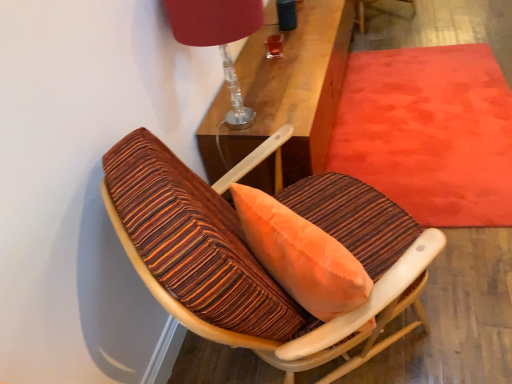
Where is `wooden textured chair at center`? Image resolution: width=512 pixels, height=384 pixels. wooden textured chair at center is located at coordinates (220, 262).

Image resolution: width=512 pixels, height=384 pixels. Identify the location of velvet red mat at upper right. (429, 132).

This screenshot has height=384, width=512. Find the location of `wooden textured chair at center`. wooden textured chair at center is located at coordinates (220, 262).

Is wooden textured chair at center facing towards velvet red mat at upper right?

Yes, wooden textured chair at center is oriented towards velvet red mat at upper right.

Which of these two, wooden textured chair at center or velvet red mat at upper right, is bigger?

wooden textured chair at center.

Who is more distant, wooden textured chair at center or velvet red mat at upper right?

velvet red mat at upper right is further away from the camera.

From the picture: From a real-world perspective, is wooden textured chair at center located higher than velvet red mat at upper right?

Yes.

From a real-world perspective, is matte red lampshade at upper center positioned above or below velvet red mat at upper right?

matte red lampshade at upper center is above velvet red mat at upper right.

Is matte red lampshade at upper center outside of velvet red mat at upper right?

Yes, matte red lampshade at upper center is outside of velvet red mat at upper right.

How many degrees apart are the facing directions of matte red lampshade at upper center and velvet red mat at upper right?

They differ by 3.6 degrees in their facing directions.

Does matte red lampshade at upper center appear on the left side of velvet red mat at upper right?

Yes.

Is velvet red mat at upper right looking in the opposite direction of wooden textured chair at center?

No.

Where is `chair above the velvet red mat at upper right (from a real-world perspective)`? This screenshot has height=384, width=512. chair above the velvet red mat at upper right (from a real-world perspective) is located at coordinates (220, 262).

Is velvet red mat at upper right not within wooden textured chair at center?

velvet red mat at upper right lies outside wooden textured chair at center's area.

Who is taller, velvet red mat at upper right or matte red lampshade at upper center?

Standing taller between the two is matte red lampshade at upper center.

Does velvet red mat at upper right have a larger size compared to matte red lampshade at upper center?

Indeed, velvet red mat at upper right has a larger size compared to matte red lampshade at upper center.

Could you tell me if velvet red mat at upper right is facing matte red lampshade at upper center?

No, velvet red mat at upper right does not turn towards matte red lampshade at upper center.

Relative to matte red lampshade at upper center, is velvet red mat at upper right in front or behind?

Visually, velvet red mat at upper right is located behind matte red lampshade at upper center.

Does matte red lampshade at upper center have a lesser height compared to wooden textured chair at center?

Yes, matte red lampshade at upper center is shorter than wooden textured chair at center.

Can you tell me how much matte red lampshade at upper center and wooden textured chair at center differ in facing direction?

matte red lampshade at upper center and wooden textured chair at center are facing 53.5 degrees away from each other.

Does matte red lampshade at upper center have a lesser width compared to wooden textured chair at center?

Yes.

Looking at this image, how distant is matte red lampshade at upper center from wooden textured chair at center?

26.70 inches.

From the image's perspective, is wooden textured chair at center above matte red lampshade at upper center?

No, from the image's perspective, wooden textured chair at center is not above matte red lampshade at upper center.

From a real-world perspective, between wooden textured chair at center and matte red lampshade at upper center, who is vertically higher?

In real-world perspective, matte red lampshade at upper center is above.

Is wooden textured chair at center not inside matte red lampshade at upper center?

Absolutely, wooden textured chair at center is external to matte red lampshade at upper center.

Would you say wooden textured chair at center is a long distance from matte red lampshade at upper center?

That's not correct — wooden textured chair at center is a little close to matte red lampshade at upper center.

I want to click on chair located on the left of velvet red mat at upper right, so click(x=220, y=262).

Find the location of a particular element. mat on the right of matte red lampshade at upper center is located at coordinates (429, 132).

Consider the image. From the image, which object appears to be nearer to wooden textured chair at center, matte red lampshade at upper center or velvet red mat at upper right?

matte red lampshade at upper center is closer to wooden textured chair at center.

From the image, which object appears to be nearer to velvet red mat at upper right, wooden textured chair at center or matte red lampshade at upper center?

Among the two, wooden textured chair at center is located nearer to velvet red mat at upper right.

Looking at the image, which one is located further to wooden textured chair at center, velvet red mat at upper right or matte red lampshade at upper center?

Based on the image, velvet red mat at upper right appears to be further to wooden textured chair at center.

Looking at the image, which one is located closer to matte red lampshade at upper center, wooden textured chair at center or velvet red mat at upper right?

Based on the image, wooden textured chair at center appears to be nearer to matte red lampshade at upper center.

Which object lies further to the anchor point matte red lampshade at upper center, velvet red mat at upper right or wooden textured chair at center?

velvet red mat at upper right is further to matte red lampshade at upper center.

Considering their positions, is matte red lampshade at upper center positioned further to velvet red mat at upper right than wooden textured chair at center?

The object further to velvet red mat at upper right is matte red lampshade at upper center.

Image resolution: width=512 pixels, height=384 pixels. Identify the location of chair between matte red lampshade at upper center and velvet red mat at upper right. (220, 262).